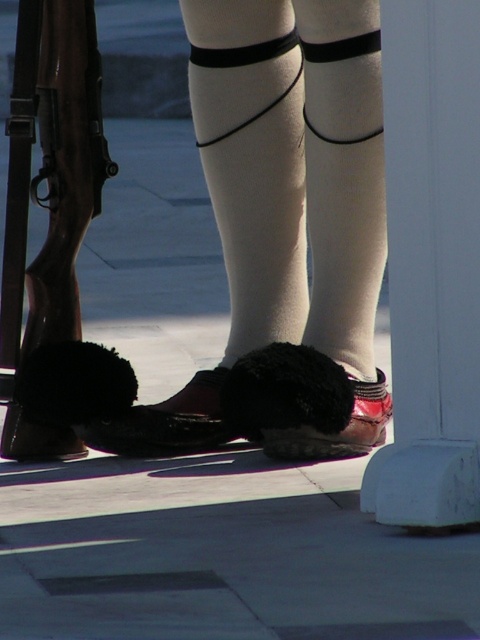
You are a tailor measuring the lower legs of a person wearing white smooth socks at center and shiny brown shoe at center. Which item has a larger circumference around the lower leg?

The white smooth socks at center has a larger size compared to shiny brown shoe at center, so the white smooth socks at center has a larger circumference around the lower leg.

You are a tailor measuring the height of the white smooth socks at center and the shiny black shoe at center for a uniform adjustment. Which item is taller?

The white smooth socks at center is taller than the shiny black shoe at center according to the measurements.

Based on the scene description, which shoe is positioned to the right when looking at the shiny black shoe at center and shiny brown shoe at center?

The shiny black shoe at center is to the right of the shiny brown shoe at center.